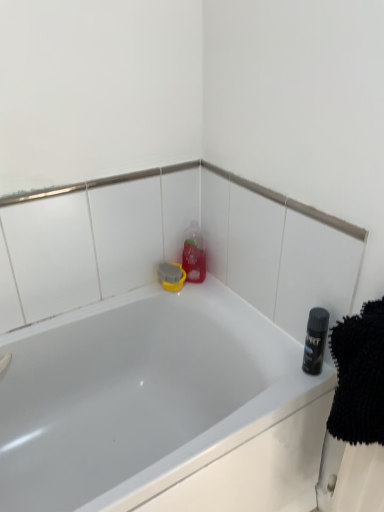
Identify the location of free space behind shiny black can at right. (269, 339).